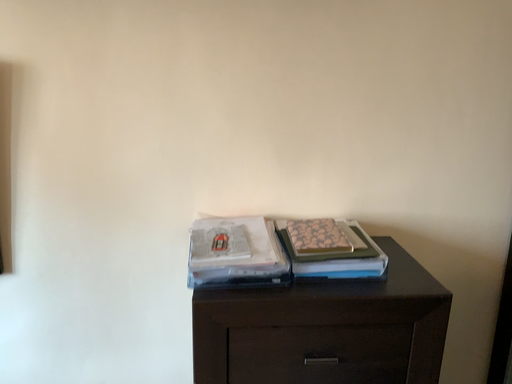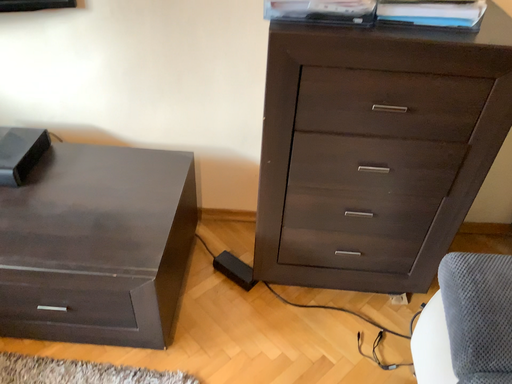
Question: Which way did the camera rotate in the video?

Choices:
 (A) rotated right
 (B) rotated left

Answer: (B)